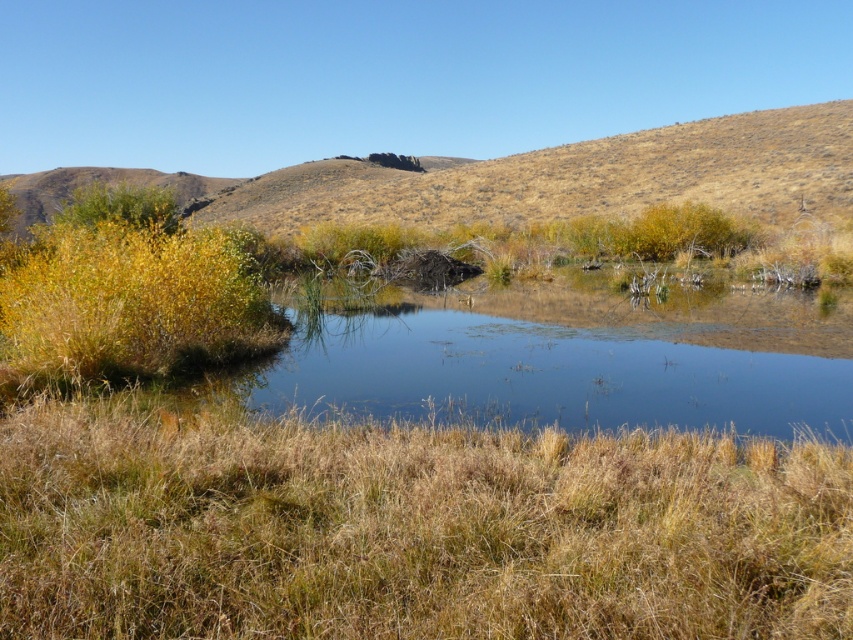
Which is above, dry grass at center or dry grass at upper center?

dry grass at upper center is higher up.

Can you confirm if dry grass at center is positioned to the right of dry grass at upper center?

Indeed, dry grass at center is positioned on the right side of dry grass at upper center.

Is point (598, 634) less distant than point (666, 182)?

Yes, it is.

Locate an element on the screen. This screenshot has height=640, width=853. dry grass at center is located at coordinates (409, 529).